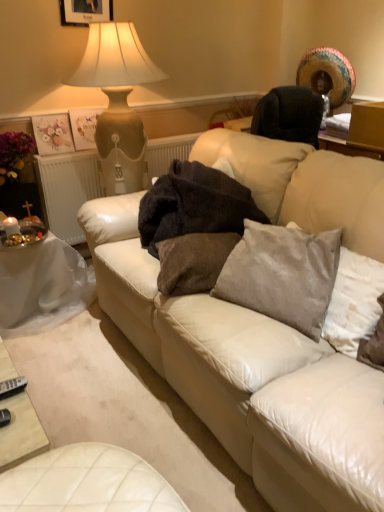
Question: Can we say dark brown plush blanket at center lies outside satin gray pillow at center, which ranks as the first pillow in right-to-left order?

Choices:
 (A) yes
 (B) no

Answer: (A)

Question: From the image's perspective, is dark brown plush blanket at center above satin gray pillow at center, which ranks as the first pillow in right-to-left order?

Choices:
 (A) no
 (B) yes

Answer: (B)

Question: Considering the relative positions of dark brown plush blanket at center and satin gray pillow at center, which ranks as the first pillow in right-to-left order, in the image provided, is dark brown plush blanket at center to the right of satin gray pillow at center, which ranks as the first pillow in right-to-left order, from the viewer's perspective?

Choices:
 (A) no
 (B) yes

Answer: (A)

Question: Considering the relative positions of dark brown plush blanket at center and satin gray pillow at center, which ranks as the first pillow in right-to-left order, in the image provided, is dark brown plush blanket at center to the left of satin gray pillow at center, which ranks as the first pillow in right-to-left order, from the viewer's perspective?

Choices:
 (A) yes
 (B) no

Answer: (A)

Question: Is dark brown plush blanket at center touching satin gray pillow at center, the second pillow viewed from the left?

Choices:
 (A) no
 (B) yes

Answer: (A)

Question: Is silver metallic remote at lower left bigger or smaller than white plastic table at lower left?

Choices:
 (A) big
 (B) small

Answer: (B)

Question: Considering the positions of silver metallic remote at lower left and white plastic table at lower left in the image, is silver metallic remote at lower left wider or thinner than white plastic table at lower left?

Choices:
 (A) thin
 (B) wide

Answer: (A)

Question: In the image, is silver metallic remote at lower left positioned in front of or behind white plastic table at lower left?

Choices:
 (A) front
 (B) behind

Answer: (A)

Question: Considering the positions of point (19, 390) and point (36, 278), is point (19, 390) closer or farther from the camera than point (36, 278)?

Choices:
 (A) closer
 (B) farther

Answer: (A)

Question: From a real-world perspective, is white plastic table at lower left positioned above or below white textured radiator at left?

Choices:
 (A) below
 (B) above

Answer: (A)

Question: From the image's perspective, relative to white textured radiator at left, is white plastic table at lower left above or below?

Choices:
 (A) above
 (B) below

Answer: (B)

Question: Is white plastic table at lower left inside the boundaries of white textured radiator at left, or outside?

Choices:
 (A) outside
 (B) inside

Answer: (A)

Question: Is point pyautogui.click(x=56, y=257) positioned closer to the camera than point pyautogui.click(x=188, y=138)?

Choices:
 (A) closer
 (B) farther

Answer: (A)

Question: Choose the correct answer: Is dark brown plush blanket at center inside white plastic table at lower left or outside it?

Choices:
 (A) outside
 (B) inside

Answer: (A)

Question: From the image's perspective, relative to white plastic table at lower left, is dark brown plush blanket at center above or below?

Choices:
 (A) below
 (B) above

Answer: (B)